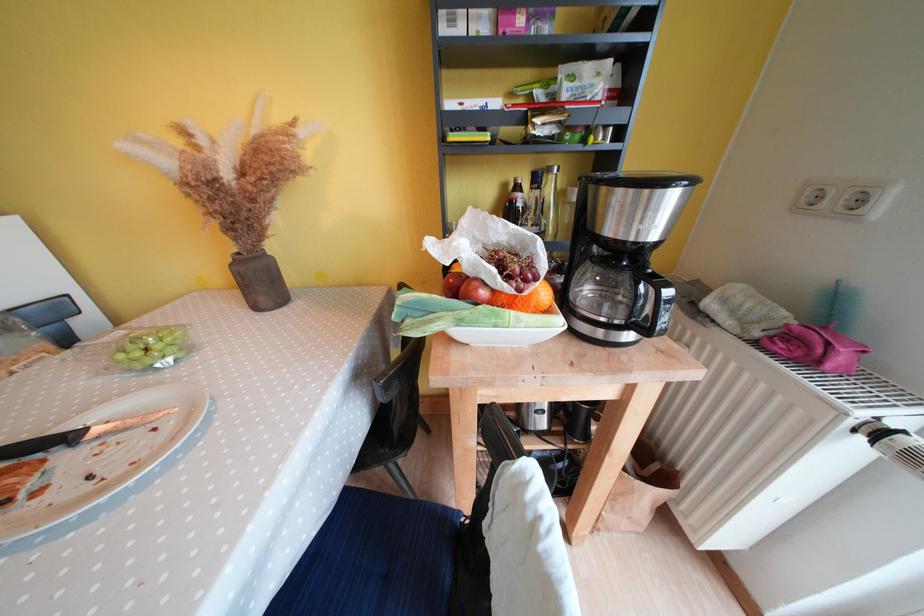
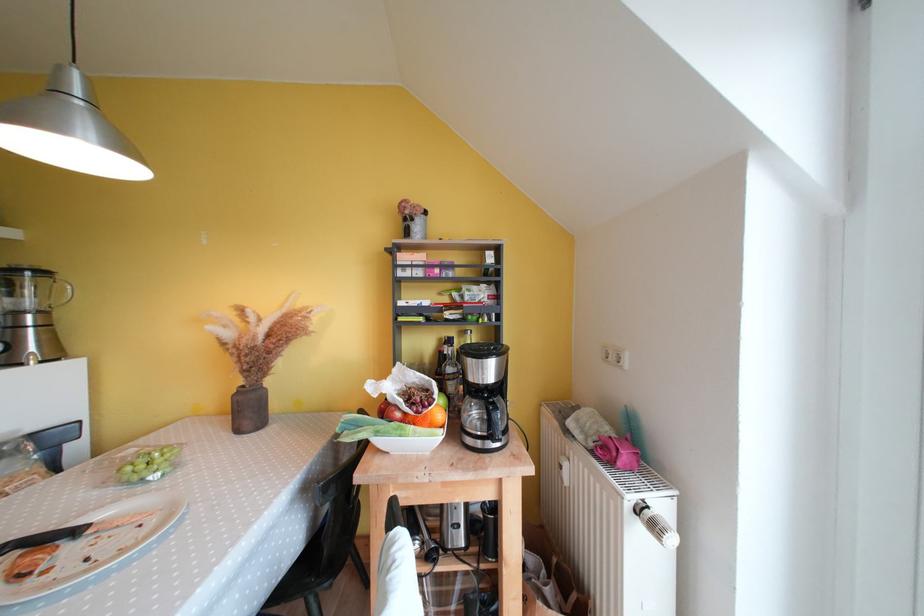
Locate, in the second image, the point that corresponds to (531,285) in the first image.

(431, 411)